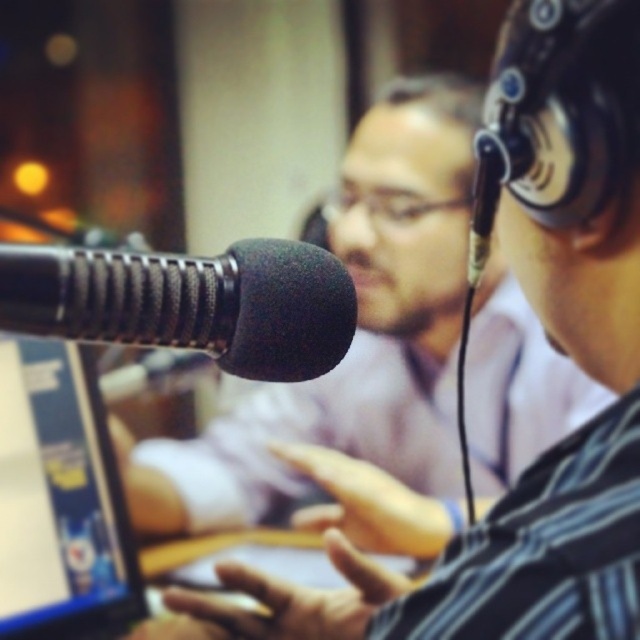
You are setting up a recording studio and need to place the black fabric microphone at left and the matte plastic laptop at left on a shelf. Which object should you place first if you want the shorter one to be in front?

The black fabric microphone at left is shorter than the matte plastic laptop at left, so you should place the black fabric microphone at left first to have it in front.

You are a guest speaker preparing to record a podcast. You need to adjust your position so that you can see both the matte plastic laptop at left and the black foam microphone at center clearly. Which object should you move closer to, and why?

You should move closer to the black foam microphone at center because it is positioned behind the matte plastic laptop at left, so moving closer to the microphone will allow you to see both objects without obstruction.

You are setting up a recording studio and need to place the black fabric microphone at left and the black foam microphone at center on a shelf. Which microphone has a greater width?

The black fabric microphone at left has a greater width than the black foam microphone at center.